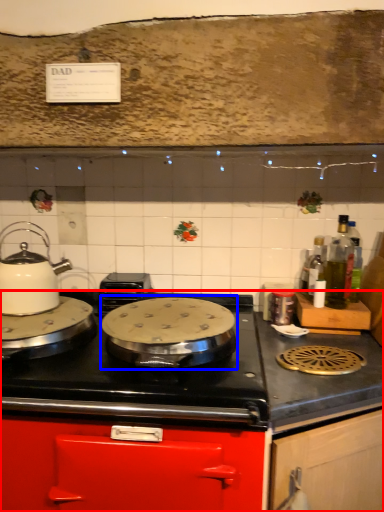
Question: Which point is further to the camera, cabinetry (highlighted by a red box) or wok (highlighted by a blue box)?

Choices:
 (A) cabinetry
 (B) wok

Answer: (B)